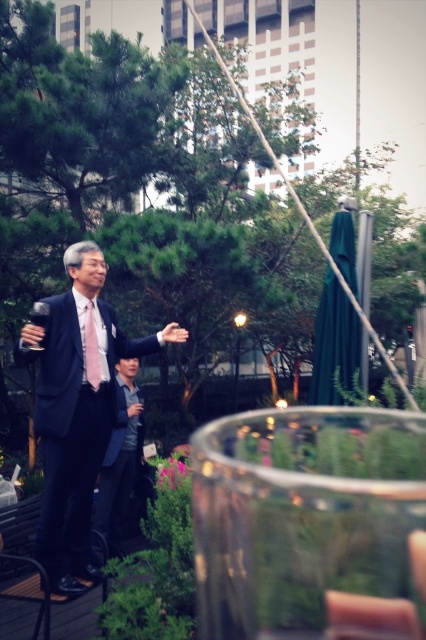
Question: Is green fabric umbrella at upper right smaller than pink satin tie at center?

Choices:
 (A) no
 (B) yes

Answer: (A)

Question: Which object is positioned closest to the matte black suit at center?

Choices:
 (A) pink satin tie at center
 (B) dark gray suit at center

Answer: (A)

Question: Does matte black suit at center appear on the right side of pink satin tie at center?

Choices:
 (A) no
 (B) yes

Answer: (B)

Question: Can you confirm if dark gray suit at center is positioned to the left of pink satin tie at center?

Choices:
 (A) no
 (B) yes

Answer: (B)

Question: Which of these objects is positioned closest to the green fabric umbrella at upper right?

Choices:
 (A) matte black suit at center
 (B) pink satin tie at center

Answer: (A)

Question: Which point is farther from the camera taking this photo?

Choices:
 (A) (129, 378)
 (B) (88, 467)

Answer: (A)